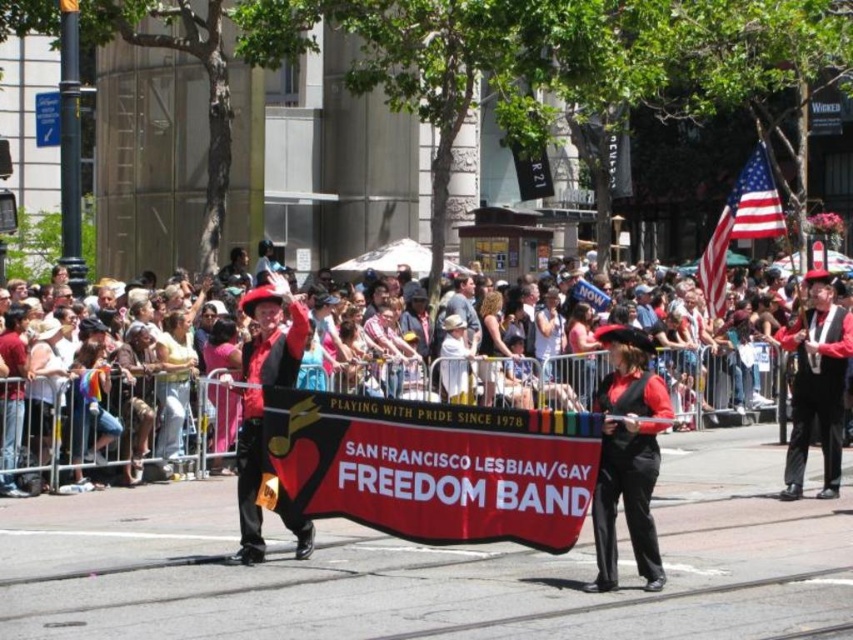
Who is more distant from viewer, [285,467] or [640,497]?

The point [285,467] is more distant.

Who is more distant from viewer, (x=381, y=504) or (x=662, y=388)?

Point (x=381, y=504)

Where is `red fabric banner at center`? This screenshot has width=853, height=640. red fabric banner at center is located at coordinates (433, 467).

Is point (318, 365) more distant than point (747, 168)?

Yes, it is behind point (747, 168).

Who is lower down, matte black banner at center or american flag at upper right?

matte black banner at center is lower down.

Between point (332, 380) and point (712, 314), which one is positioned in front?

Point (712, 314)

In order to click on matte black banner at center in this screenshot , I will do `click(112, 419)`.

Is matte black banner at center smaller than matte red hat at center?

No.

Is point (215, 444) farther from camera compared to point (621, 422)?

Yes.

Where is `matte black banner at center`? matte black banner at center is located at coordinates (112, 419).